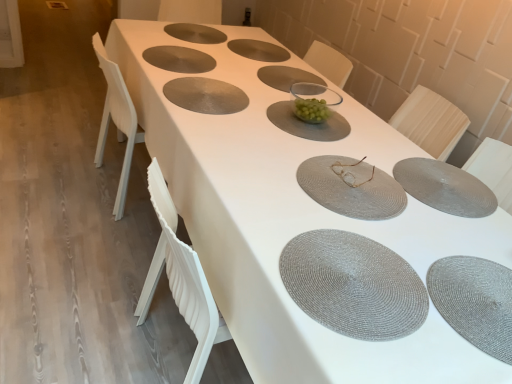
The width and height of the screenshot is (512, 384). Identify the location of free space to the left of gray woven placemat at center. (251, 224).